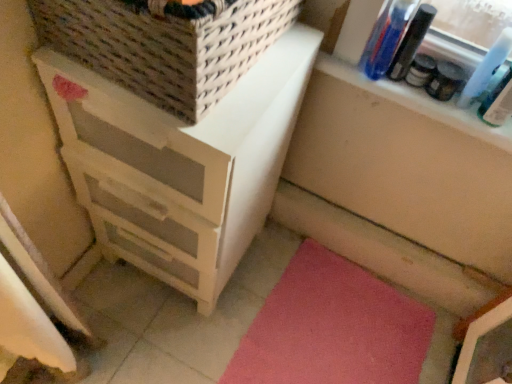
Question: Can you confirm if pink carpet at lower right is shorter than clear plastic bottles at upper right?

Choices:
 (A) no
 (B) yes

Answer: (B)

Question: Is pink carpet at lower right taller than clear plastic bottles at upper right?

Choices:
 (A) no
 (B) yes

Answer: (A)

Question: Does pink carpet at lower right contain clear plastic bottles at upper right?

Choices:
 (A) no
 (B) yes

Answer: (A)

Question: Is pink carpet at lower right at the right side of clear plastic bottles at upper right?

Choices:
 (A) no
 (B) yes

Answer: (A)

Question: Is the surface of pink carpet at lower right in direct contact with clear plastic bottles at upper right?

Choices:
 (A) yes
 (B) no

Answer: (B)

Question: Is pink carpet at lower right in front of or behind white wood chest of drawers at left in the image?

Choices:
 (A) behind
 (B) front

Answer: (A)

Question: Is point [x=286, y=286] positioned closer to the camera than point [x=74, y=117]?

Choices:
 (A) farther
 (B) closer

Answer: (A)

Question: Looking at the image, does pink carpet at lower right seem bigger or smaller compared to white wood chest of drawers at left?

Choices:
 (A) big
 (B) small

Answer: (B)

Question: From the image's perspective, is pink carpet at lower right located above or below white wood chest of drawers at left?

Choices:
 (A) below
 (B) above

Answer: (A)

Question: Considering their positions, is woven beige basket at upper left located in front of or behind white wood chest of drawers at left?

Choices:
 (A) front
 (B) behind

Answer: (A)

Question: In the image, is woven beige basket at upper left on the left side or the right side of white wood chest of drawers at left?

Choices:
 (A) left
 (B) right

Answer: (B)

Question: From a real-world perspective, relative to white wood chest of drawers at left, is woven beige basket at upper left vertically above or below?

Choices:
 (A) below
 (B) above

Answer: (B)

Question: Is woven beige basket at upper left bigger or smaller than white wood chest of drawers at left?

Choices:
 (A) big
 (B) small

Answer: (B)

Question: From a real-world perspective, is clear plastic bottles at upper right physically located above or below white wood chest of drawers at left?

Choices:
 (A) above
 (B) below

Answer: (A)

Question: Is point (475, 52) positioned closer to the camera than point (305, 64)?

Choices:
 (A) closer
 (B) farther

Answer: (B)